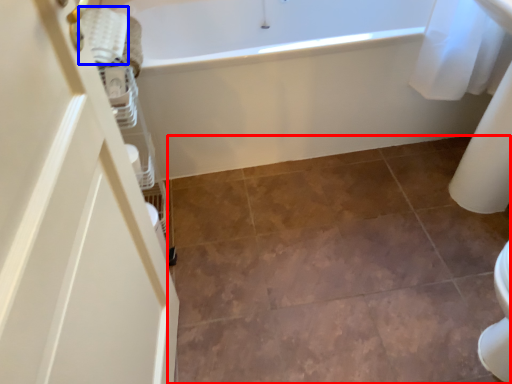
Question: Among these objects, which one is farthest to the camera, ceramic tile (highlighted by a red box) or material (highlighted by a blue box)?

Choices:
 (A) ceramic tile
 (B) material

Answer: (B)